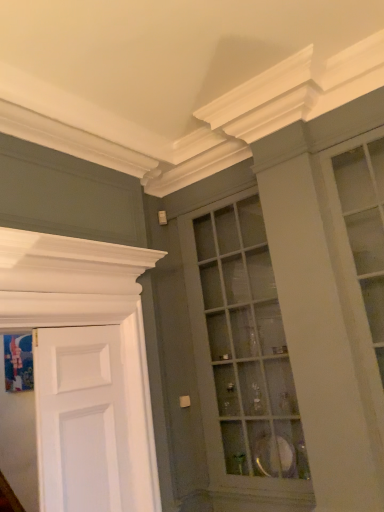
Locate an element on the screen. The image size is (384, 512). white matte door at left is located at coordinates (80, 420).

What do you see at coordinates (80, 420) in the screenshot? I see `white matte door at left` at bounding box center [80, 420].

The image size is (384, 512). In order to click on matte glass cabinet at center in this screenshot , I will do `click(242, 354)`.

The height and width of the screenshot is (512, 384). Describe the element at coordinates (242, 354) in the screenshot. I see `matte glass cabinet at center` at that location.

This screenshot has width=384, height=512. Identify the location of white matte door at left. [80, 420].

Looking at this image, based on their positions, is matte glass cabinet at center located to the left or right of white matte door at left?

Clearly, matte glass cabinet at center is on the right of white matte door at left in the image.

Is matte glass cabinet at center positioned in front of white matte door at left?

No, it is not.

Based on the photo, which point is more distant from viewer, (x=192, y=248) or (x=98, y=436)?

Positioned behind is point (x=192, y=248).

From the image's perspective, which is below, matte glass cabinet at center or white matte door at left?

white matte door at left, from the image's perspective.

From a real-world perspective, which object rests below the other?

In real-world perspective, white matte door at left is lower.

Which object is thinner, matte glass cabinet at center or white matte door at left?

white matte door at left is thinner.

Considering the relative sizes of matte glass cabinet at center and white matte door at left in the image provided, is matte glass cabinet at center shorter than white matte door at left?

No.

Considering the relative sizes of matte glass cabinet at center and white matte door at left in the image provided, is matte glass cabinet at center smaller than white matte door at left?

No, matte glass cabinet at center is not smaller than white matte door at left.

Can we say matte glass cabinet at center lies outside white matte door at left?

Yes, matte glass cabinet at center is located beyond the bounds of white matte door at left.

Looking at this image, is matte glass cabinet at center in contact with white matte door at left?

There is a gap between matte glass cabinet at center and white matte door at left.

Is matte glass cabinet at center positioned with its back to white matte door at left?

No, matte glass cabinet at center is not facing away from white matte door at left.

Can you tell me how much matte glass cabinet at center and white matte door at left differ in facing direction?

There is a 88.9-degree angle between the facing directions of matte glass cabinet at center and white matte door at left.

You are a GUI agent. You are given a task and a screenshot of the screen. Output one action in this format:
    pyautogui.click(x=<x>, y=<y>)
    Task: Click on the door below the matte glass cabinet at center (from a real-world perspective)
    The image size is (384, 512).
    Given the screenshot: What is the action you would take?
    pyautogui.click(x=80, y=420)

Can you confirm if white matte door at left is positioned to the right of matte glass cabinet at center?

A: Incorrect, white matte door at left is not on the right side of matte glass cabinet at center.

Which is behind, white matte door at left or matte glass cabinet at center?

matte glass cabinet at center is behind.

Which is closer to the camera, [44,357] or [240,420]?

The point [44,357] is closer to the camera.

In the scene shown: From the image's perspective, relative to matte glass cabinet at center, is white matte door at left above or below?

From the image's perspective, white matte door at left appears below matte glass cabinet at center.

From a real-world perspective, is white matte door at left located higher than matte glass cabinet at center?

No, from a real-world perspective, white matte door at left is not on top of matte glass cabinet at center.

Which of these two, white matte door at left or matte glass cabinet at center, is thinner?

Thinner between the two is white matte door at left.

Is white matte door at left taller than matte glass cabinet at center?

No, white matte door at left is not taller than matte glass cabinet at center.

Which of these two, white matte door at left or matte glass cabinet at center, is smaller?

Smaller between the two is white matte door at left.

Is white matte door at left located outside matte glass cabinet at center?

Absolutely, white matte door at left is external to matte glass cabinet at center.

Is white matte door at left with matte glass cabinet at center?

No, white matte door at left is not next to matte glass cabinet at center.

Looking at this image, does white matte door at left turn towards matte glass cabinet at center?

No.

Locate an element on the screen. This screenshot has width=384, height=512. door lying on the left of matte glass cabinet at center is located at coordinates (80, 420).

Identify the location of door located underneath the matte glass cabinet at center (from a real-world perspective). tap(80, 420).

I want to click on window on the right of white matte door at left, so click(x=242, y=354).